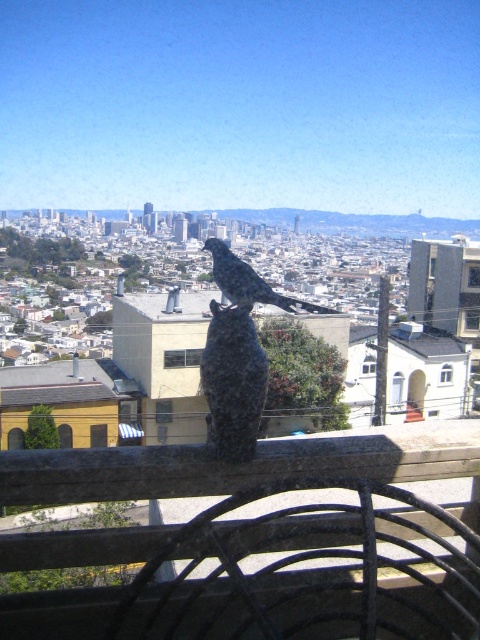
Question: Can you confirm if granite statue at center is bigger than rustic stone bird at center?

Choices:
 (A) no
 (B) yes

Answer: (A)

Question: Considering the relative positions of granite statue at center and rustic stone bird at center in the image provided, where is granite statue at center located with respect to rustic stone bird at center?

Choices:
 (A) above
 (B) below

Answer: (B)

Question: Which point is closer to the camera?

Choices:
 (A) rustic stone bird at center
 (B) granite statue at center

Answer: (A)

Question: Is the position of granite statue at center more distant than that of rustic stone bird at center?

Choices:
 (A) yes
 (B) no

Answer: (A)